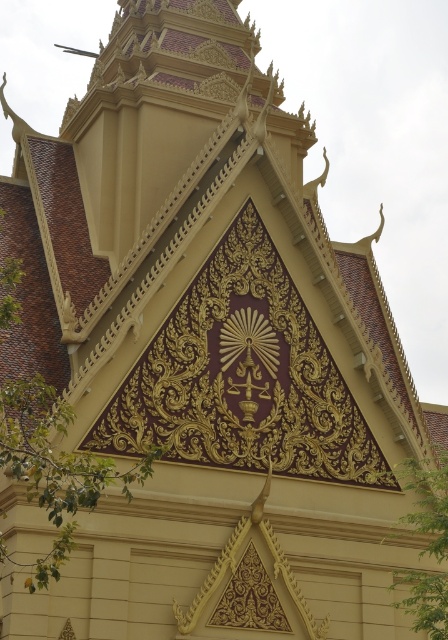
Is green leafy tree at center further to the viewer compared to green leafy tree at lower right?

No.

Does green leafy tree at center appear over green leafy tree at lower right?

Yes, green leafy tree at center is above green leafy tree at lower right.

Describe the element at coordinates (54, 467) in the screenshot. I see `green leafy tree at center` at that location.

Find the location of a particular element. This screenshot has width=448, height=640. green leafy tree at center is located at coordinates (54, 467).